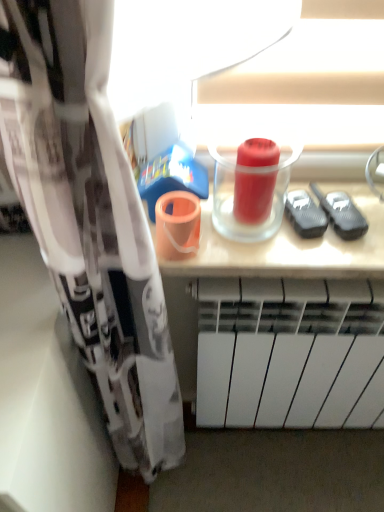
Where is `vacant area that lies to the right of red matte cup at center`? Image resolution: width=384 pixels, height=512 pixels. vacant area that lies to the right of red matte cup at center is located at coordinates pyautogui.click(x=331, y=226).